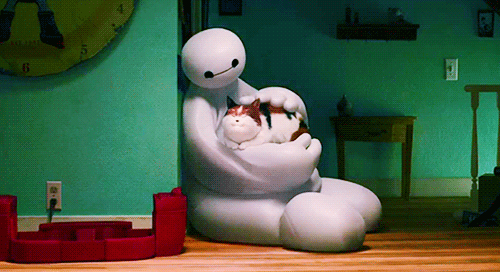
This screenshot has height=272, width=500. Identify the location of shelf. (383, 32).